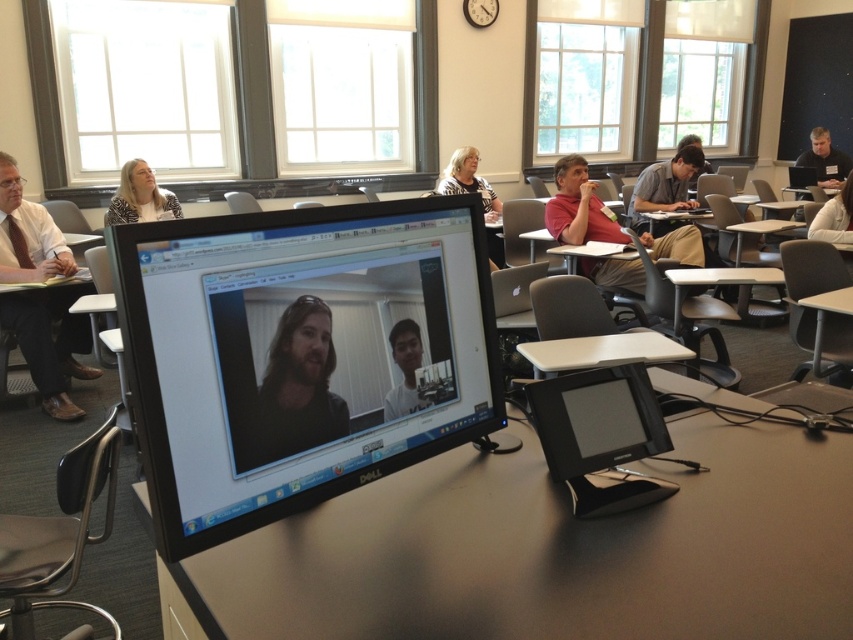
Does white plastic table at center have a lesser width compared to matte black laptop at upper center?

Yes, white plastic table at center is thinner than matte black laptop at upper center.

Is point (543, 346) farther from camera compared to point (697, 147)?

No, it is in front of (697, 147).

In order to click on white plastic table at center in this screenshot , I will do `click(602, 352)`.

The image size is (853, 640). What do you see at coordinates (404, 369) in the screenshot?
I see `smooth skin face at center` at bounding box center [404, 369].

Does smooth skin face at center have a smaller size compared to light brown hair at upper center?

Yes, smooth skin face at center is smaller than light brown hair at upper center.

What do you see at coordinates (404, 369) in the screenshot? The image size is (853, 640). I see `smooth skin face at center` at bounding box center [404, 369].

Where is `smooth skin face at center`? smooth skin face at center is located at coordinates (404, 369).

Does matte red shirt at center come behind black shirt at right?

No, it is in front of black shirt at right.

Which is behind, point (583, 168) or point (838, 172)?

Point (838, 172)

Where is `matte red shirt at center`? The height and width of the screenshot is (640, 853). matte red shirt at center is located at coordinates (578, 208).